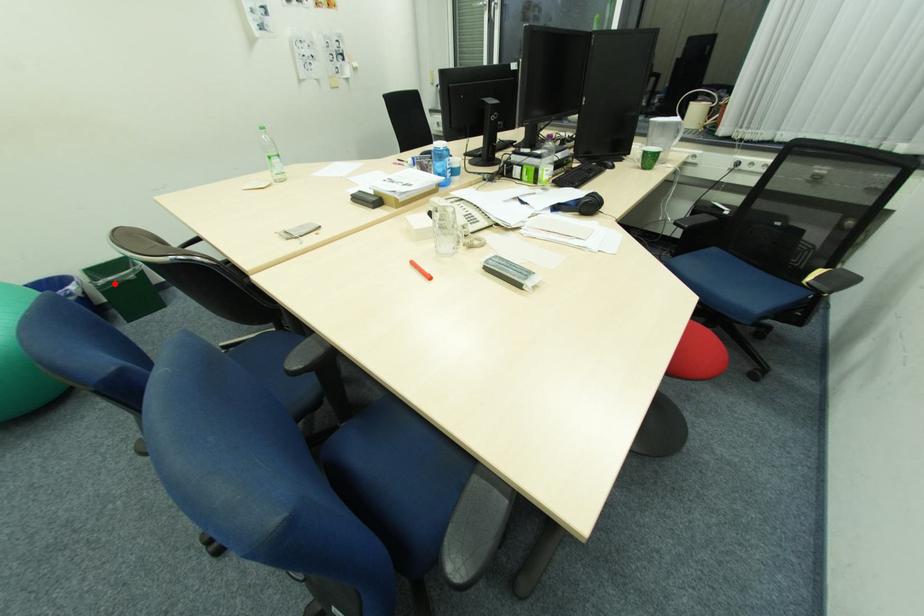
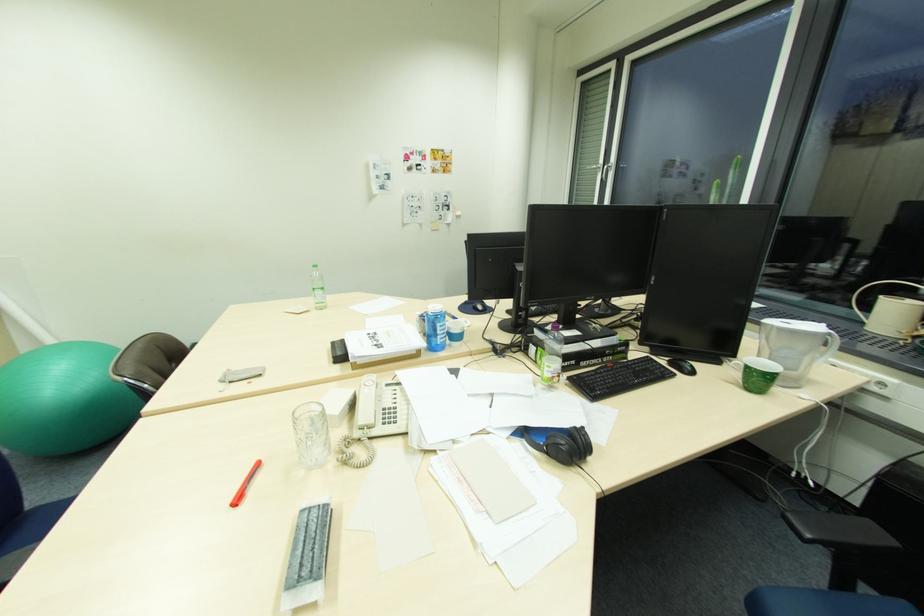
Question: I am providing you with two images of the same scene from different viewpoints. A red point is marked on the first image. At the location where the point appears in image 1, is it still visible in image 2?

Choices:
 (A) Yes
 (B) No

Answer: (B)